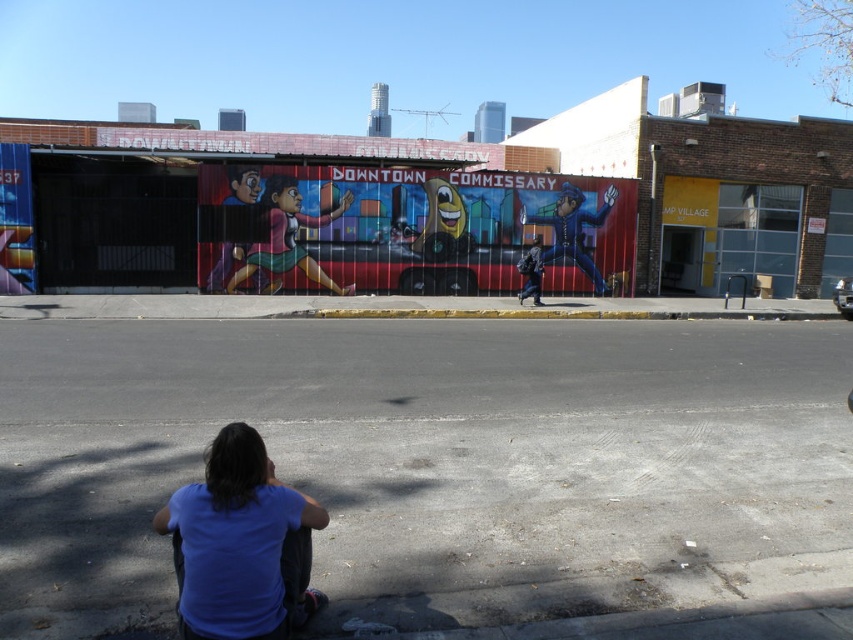
Is blue cotton shirt at lower center positioned at the back of blue uniform at center?

No, blue cotton shirt at lower center is in front of blue uniform at center.

Is point (215, 637) positioned behind point (602, 284)?

No, (215, 637) is closer to viewer.

Is point (216, 515) positioned behind point (614, 198)?

No, it is not.

This screenshot has width=853, height=640. Find the location of `blue cotton shirt at lower center`. blue cotton shirt at lower center is located at coordinates (241, 545).

Consider the image. Does gray asphalt at lower center have a greater height compared to blue cotton shirt at lower center?

Yes.

In the scene shown: Is gray asphalt at lower center thinner than blue cotton shirt at lower center?

In fact, gray asphalt at lower center might be wider than blue cotton shirt at lower center.

Who is more forward, [554,500] or [254,524]?

Positioned in front is point [254,524].

I want to click on gray asphalt at lower center, so click(427, 460).

Is gray asphalt at lower center to the right of blue uniform at center from the viewer's perspective?

No, gray asphalt at lower center is not to the right of blue uniform at center.

Is point (799, 452) farther from viewer compared to point (548, 250)?

No.

Find the location of a particular element. The height and width of the screenshot is (640, 853). gray asphalt at lower center is located at coordinates (427, 460).